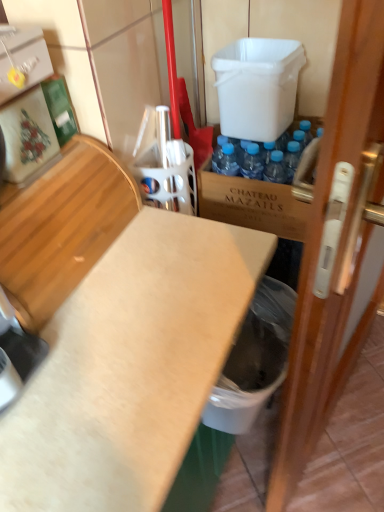
Question: Does brown wooden crate at center appear on the left side of white plastic trash can at lower right?

Choices:
 (A) yes
 (B) no

Answer: (B)

Question: From a real-world perspective, is brown wooden crate at center on top of white plastic trash can at lower right?

Choices:
 (A) no
 (B) yes

Answer: (B)

Question: Is brown wooden crate at center positioned with its back to white plastic trash can at lower right?

Choices:
 (A) yes
 (B) no

Answer: (B)

Question: Is brown wooden crate at center aimed at white plastic trash can at lower right?

Choices:
 (A) no
 (B) yes

Answer: (B)

Question: Is brown wooden crate at center behind white plastic trash can at lower right?

Choices:
 (A) yes
 (B) no

Answer: (A)

Question: Relative to light brown wood at left, is white plastic container at upper center in front or behind?

Choices:
 (A) front
 (B) behind

Answer: (B)

Question: Would you say white plastic container at upper center is inside or outside light brown wood at left?

Choices:
 (A) inside
 (B) outside

Answer: (B)

Question: Is white plastic container at upper center bigger or smaller than light brown wood at left?

Choices:
 (A) big
 (B) small

Answer: (B)

Question: In terms of height, does white plastic container at upper center look taller or shorter compared to light brown wood at left?

Choices:
 (A) tall
 (B) short

Answer: (A)

Question: In terms of width, does white plastic container at upper center look wider or thinner when compared to brown wooden crate at center?

Choices:
 (A) thin
 (B) wide

Answer: (A)

Question: From a real-world perspective, is white plastic container at upper center above or below brown wooden crate at center?

Choices:
 (A) above
 (B) below

Answer: (A)

Question: From the image's perspective, is white plastic container at upper center located above or below brown wooden crate at center?

Choices:
 (A) below
 (B) above

Answer: (B)

Question: Considering the positions of point (258, 118) and point (205, 216), is point (258, 118) closer or farther from the camera than point (205, 216)?

Choices:
 (A) farther
 (B) closer

Answer: (B)

Question: Considering the positions of wooden door at right and brown wooden crate at center in the image, is wooden door at right bigger or smaller than brown wooden crate at center?

Choices:
 (A) big
 (B) small

Answer: (A)

Question: Considering the positions of wooden door at right and brown wooden crate at center in the image, is wooden door at right taller or shorter than brown wooden crate at center?

Choices:
 (A) short
 (B) tall

Answer: (B)